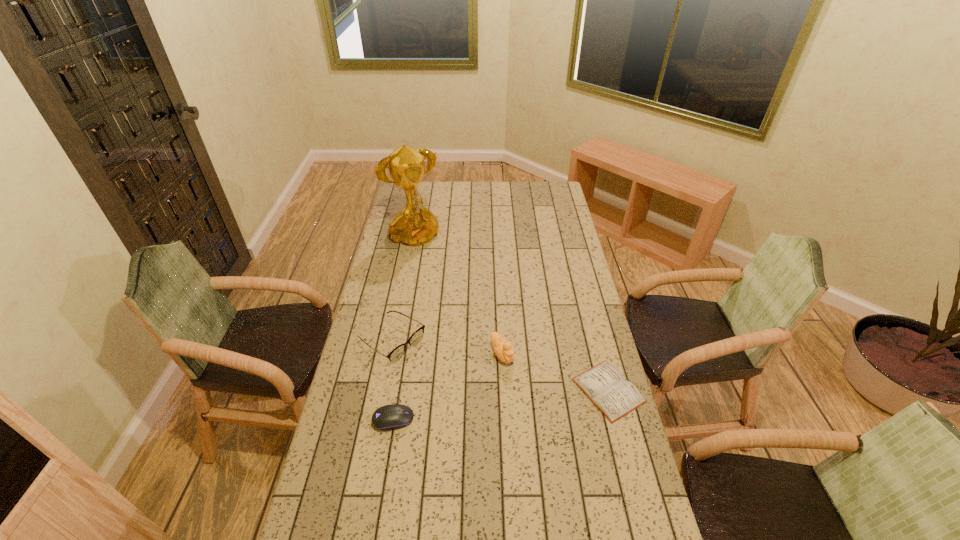
Find the location of `free space that satisfies the following two spatial constraints: 1. on the front side of the duckling; 2. on the right side of the rightmost object`. free space that satisfies the following two spatial constraints: 1. on the front side of the duckling; 2. on the right side of the rightmost object is located at coordinates (504, 390).

This screenshot has width=960, height=540. In order to click on vacant space that satisfies the following two spatial constraints: 1. on the back side of the spectacles; 2. on the left side of the farthest object in this screenshot , I will do `click(411, 240)`.